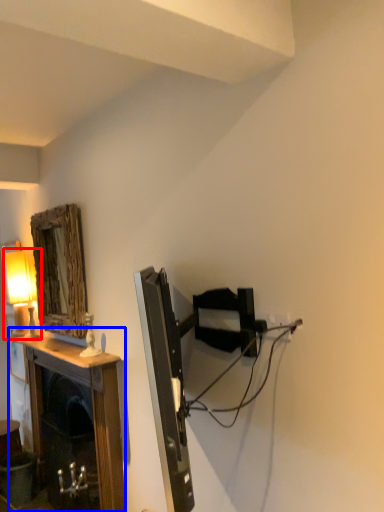
Question: Among these objects, which one is nearest to the camera, table lamp (highlighted by a red box) or table (highlighted by a blue box)?

Choices:
 (A) table lamp
 (B) table

Answer: (B)